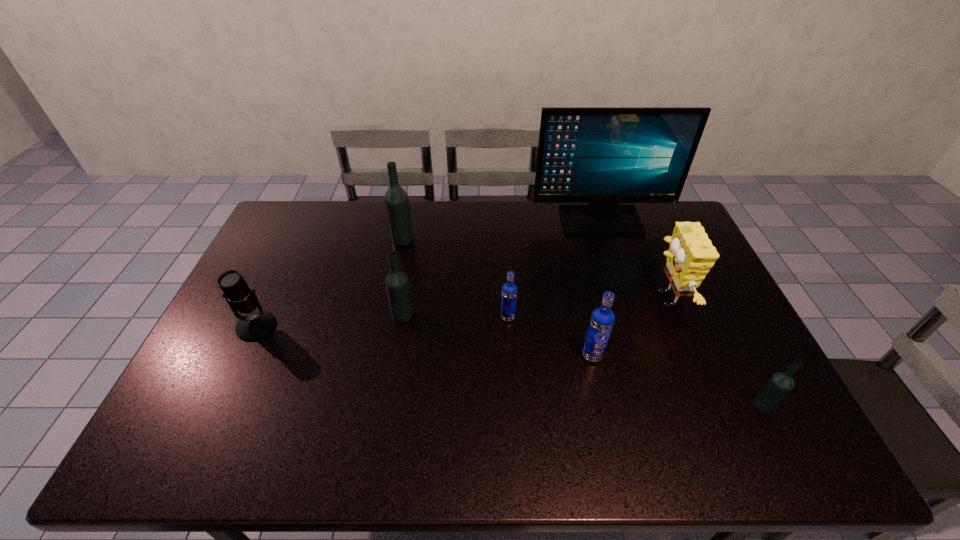
Identify which black vodka is the closest to the biggest black vodka. Please provide its 2D coordinates. Your answer should be formatted as a tuple, i.e. [(x, y)], where the tuple contains the x and y coordinates of a point satisfying the conditions above.

[(397, 285)]

Select which black vodka is the closest to the third vodka from right to left. Please provide its 2D coordinates. Your answer should be formatted as a tuple, i.e. [(x, y)], where the tuple contains the x and y coordinates of a point satisfying the conditions above.

[(397, 285)]

This screenshot has width=960, height=540. What are the coordinates of `free space that satisfies the following two spatial constraints: 1. on the back side of the leftmost object; 2. on the left side of the second biggest black vodka` in the screenshot? It's located at (262, 314).

Where is `blank area in the image that satisfies the following two spatial constraints: 1. on the back side of the rightmost black vodka; 2. on the front-facing side of the yellow sponge`? The width and height of the screenshot is (960, 540). blank area in the image that satisfies the following two spatial constraints: 1. on the back side of the rightmost black vodka; 2. on the front-facing side of the yellow sponge is located at coordinates (709, 299).

Identify the location of free space that satisfies the following two spatial constraints: 1. on the front side of the microphone; 2. on the left side of the bigger blue vodka. (242, 356).